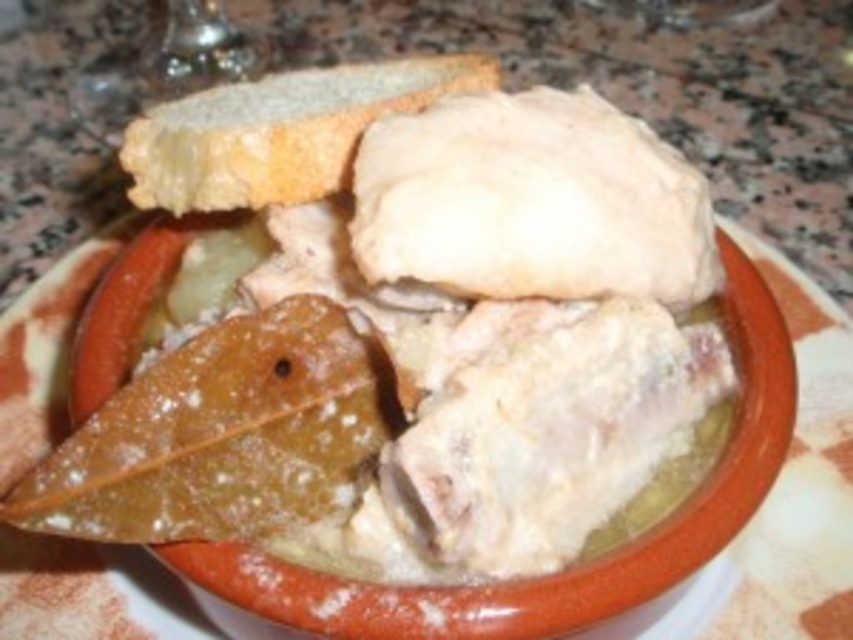
You are standing in front of the bowl of food and want to place a spoon exactly at the point with coordinates [422,356]. According to the scene description, where should you place the spoon?

You should place the spoon on the white matte leaf at upper left because the point [422,356] is located there.

You are arranging a picnic basket and need to place the white matte leaf at upper left and the spongy white bread at upper center. According to the image, which item is located below the other?

The white matte leaf at upper left is positioned under the spongy white bread at upper center, so the leaf is below the bread.